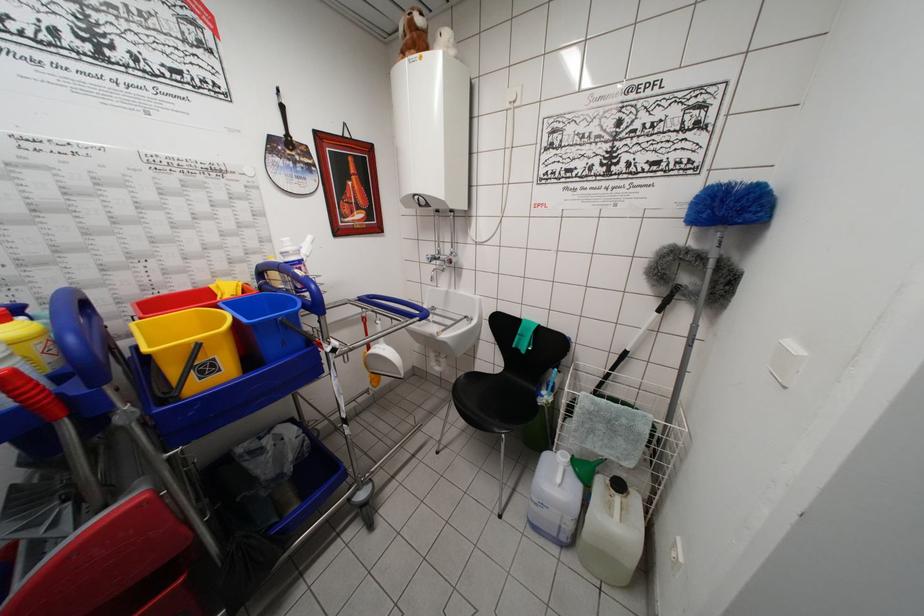
What do you see at coordinates (395, 306) in the screenshot? The height and width of the screenshot is (616, 924). I see `the blue cart handle` at bounding box center [395, 306].